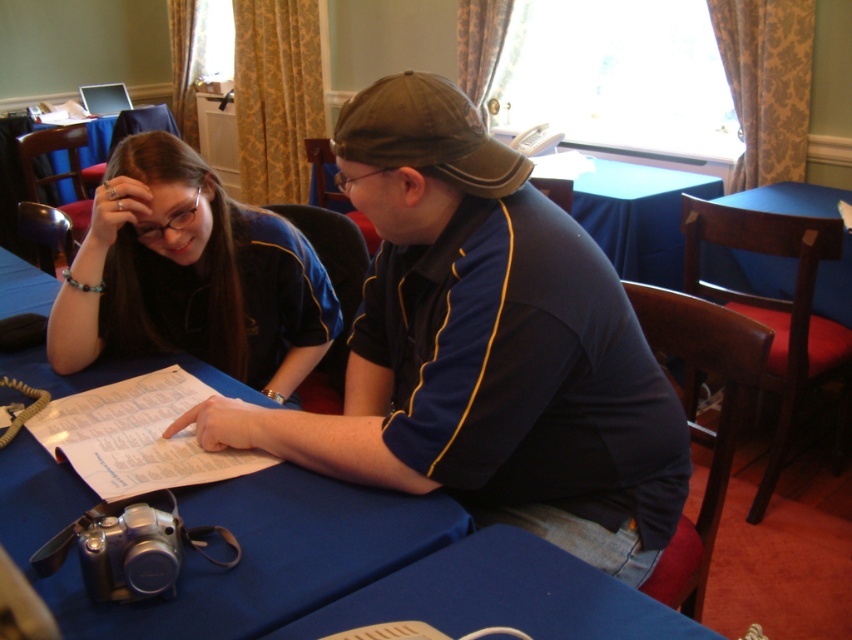
Please provide the 2D coordinates of the blue fabric table at center as observed in the scene.

The blue fabric table at center is located at the 2D coordinates of point (237,540).

You are a photographer standing 1.5 meters away from the camera. You want to adjust the settings on the dark blue jersey at center. Can you reach it without moving the camera?

The dark blue jersey at center is 1.04 meters away from the camera. Since you are 1.5 meters away from the camera, the total distance between you and the dark blue jersey at center is 2.54 meters. You cannot reach it without moving the camera.